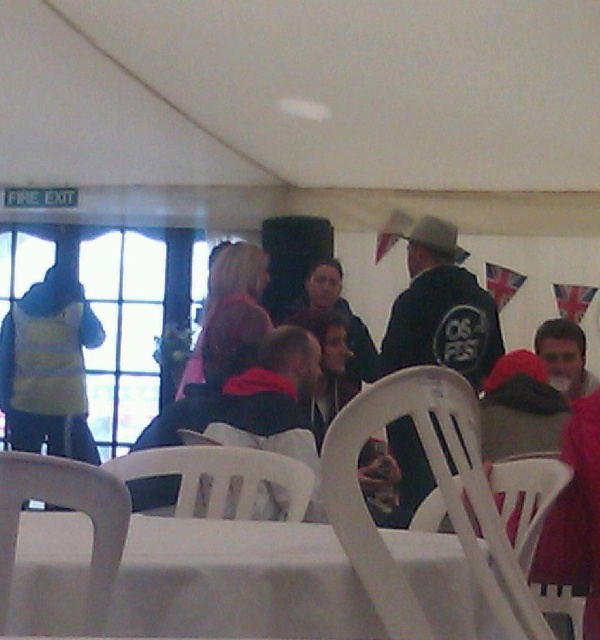
Who is lower down, white plastic table at lower center or smooth gray shirt at center?

Positioned lower is white plastic table at lower center.

Is white plastic table at lower center thinner than smooth gray shirt at center?

Incorrect, white plastic table at lower center's width is not less than smooth gray shirt at center's.

Based on the photo, who is more forward, (301, 531) or (535, 340)?

Point (301, 531) is in front.

Locate an element on the screen. white plastic table at lower center is located at coordinates (238, 580).

Can you confirm if white plastic chair at lower center is bigger than smooth gray shirt at center?

Incorrect, white plastic chair at lower center is not larger than smooth gray shirt at center.

From the picture: Who is shorter, white plastic chair at lower center or smooth gray shirt at center?

white plastic chair at lower center

Image resolution: width=600 pixels, height=640 pixels. Describe the element at coordinates (220, 477) in the screenshot. I see `white plastic chair at lower center` at that location.

Find the location of a particular element. white plastic chair at lower center is located at coordinates (220, 477).

Which is more to the right, white plastic chair at lower left or smooth gray shirt at center?

Positioned to the right is smooth gray shirt at center.

Does white plastic chair at lower left have a lesser width compared to smooth gray shirt at center?

Indeed, white plastic chair at lower left has a lesser width compared to smooth gray shirt at center.

Which is behind, point (51, 460) or point (567, 340)?

The point (567, 340) is behind.

Find the location of a particular element. The height and width of the screenshot is (640, 600). white plastic chair at lower left is located at coordinates tap(70, 508).